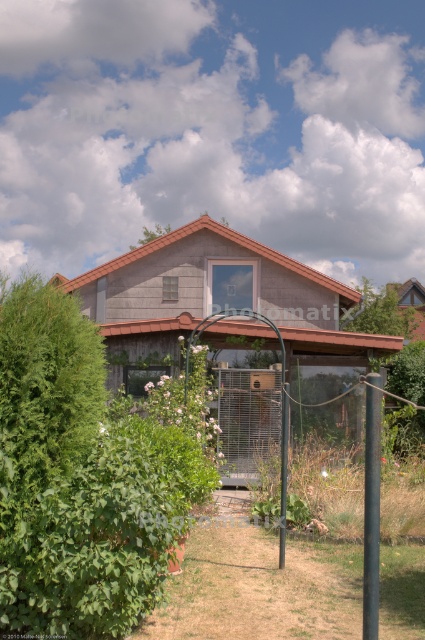
What do you see at coordinates (81, 477) in the screenshot? I see `green wood garden at center` at bounding box center [81, 477].

Who is more distant from viewer, (180,481) or (283,392)?

Positioned behind is point (283,392).

Locate an element on the screen. This screenshot has height=640, width=425. green wood garden at center is located at coordinates (81, 477).

Can you confirm if green wood garden at center is positioned to the left of metallic pole at center-right?

Indeed, green wood garden at center is positioned on the left side of metallic pole at center-right.

Does green wood garden at center have a lesser height compared to metallic pole at center-right?

No.

I want to click on green wood garden at center, so click(81, 477).

Find the location of `green wood garden at center`. green wood garden at center is located at coordinates (81, 477).

Based on the photo, who is shorter, metallic pole at center-right or metallic pole at center?

metallic pole at center-right

Is point (362, 380) positioned after point (286, 387)?

Yes, it is behind point (286, 387).

I want to click on metallic pole at center-right, so click(371, 506).